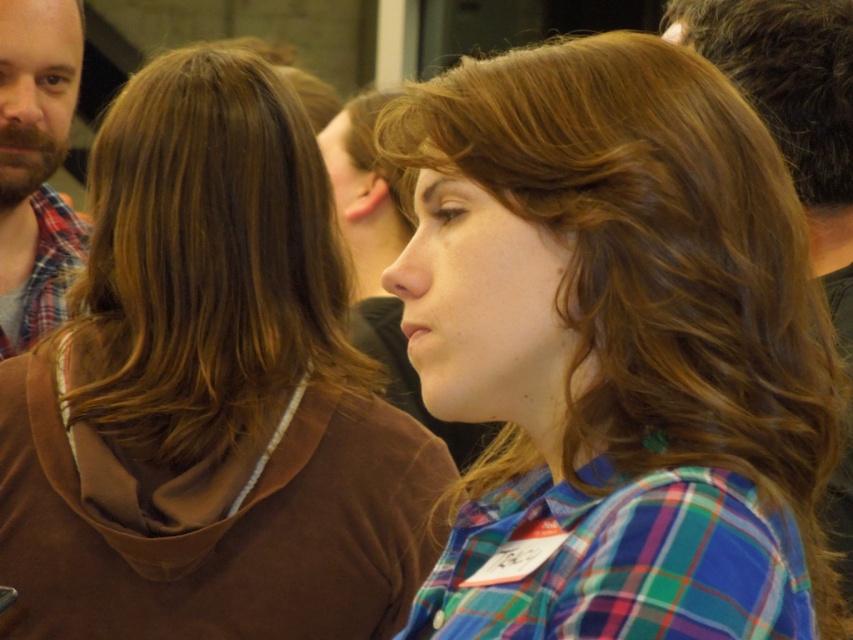
Question: Does bearded man at left appear over matte black shirt at center?

Choices:
 (A) yes
 (B) no

Answer: (A)

Question: Does bearded man at left appear on the left side of dark brown curly hair at upper right?

Choices:
 (A) no
 (B) yes

Answer: (B)

Question: Among these objects, which one is farthest from the camera?

Choices:
 (A) brown fleece at upper center
 (B) dark brown curly hair at upper right

Answer: (B)

Question: Is the position of plaid fabric shirt at center less distant than that of brown wavy hair at upper center?

Choices:
 (A) yes
 (B) no

Answer: (A)

Question: Which of the following is the closest to the observer?

Choices:
 (A) brown fleece at upper center
 (B) plaid fabric shirt at center
 (C) bearded man at left
 (D) matte black shirt at center

Answer: (B)

Question: Based on their relative distances, which object is farther from the dark brown curly hair at upper right?

Choices:
 (A) brown fleece at upper center
 (B) plaid fabric shirt at center

Answer: (A)